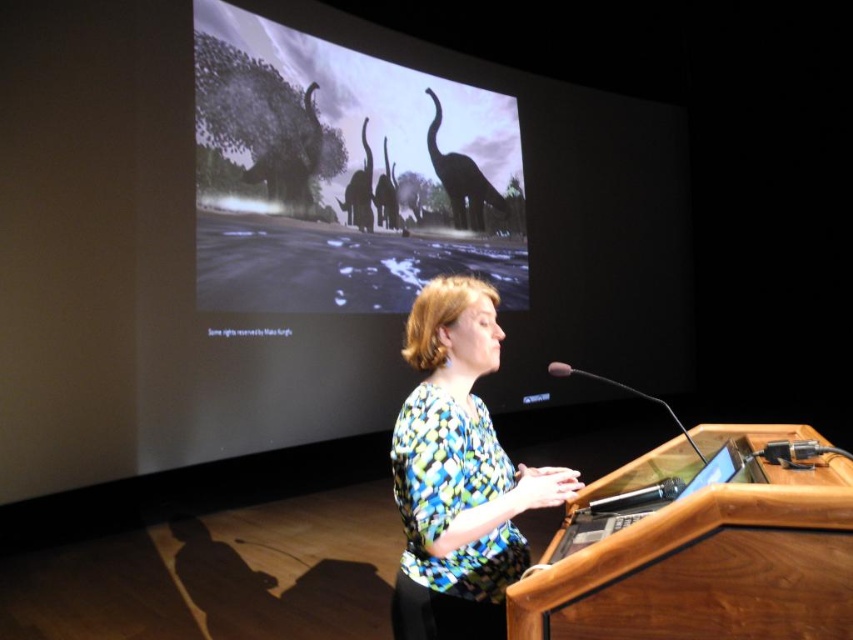
Question: Estimate the real-world distances between objects in this image. Which object is farther from the silhouette matte elephants at upper center?

Choices:
 (A) printed fabric blouse at center
 (B) wooden podium at center

Answer: (B)

Question: Is silhouette matte elephants at upper center positioned before wooden podium at center?

Choices:
 (A) no
 (B) yes

Answer: (A)

Question: From the image, what is the correct spatial relationship of silhouette matte elephants at upper center in relation to printed fabric blouse at center?

Choices:
 (A) below
 (B) above

Answer: (B)

Question: Which of the following is the farthest from the observer?

Choices:
 (A) (299, 161)
 (B) (534, 616)
 (C) (494, 336)

Answer: (A)

Question: Among these objects, which one is nearest to the camera?

Choices:
 (A) printed fabric blouse at center
 (B) wooden podium at center
 (C) silhouette matte elephants at upper center

Answer: (B)

Question: In this image, where is silhouette matte elephants at upper center located relative to printed fabric blouse at center?

Choices:
 (A) above
 (B) below

Answer: (A)